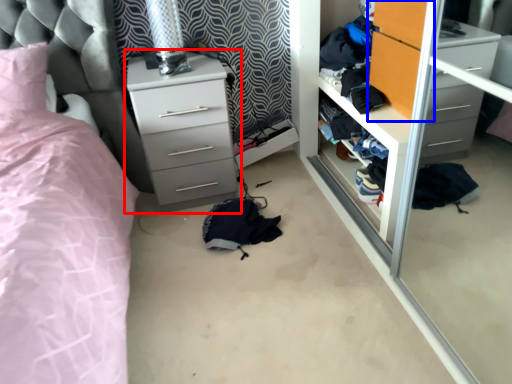
Question: Which of the following is the farthest to the observer, chest of drawers (highlighted by a red box) or armoire (highlighted by a blue box)?

Choices:
 (A) chest of drawers
 (B) armoire

Answer: (A)